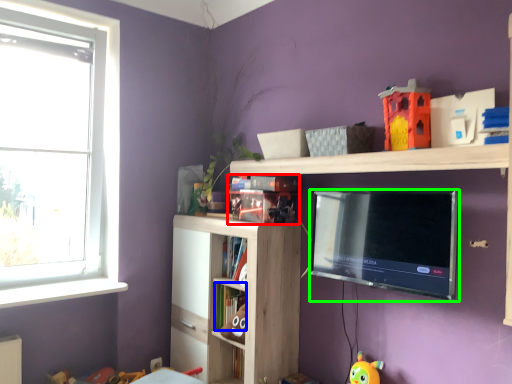
Question: Estimate the real-world distances between objects in this image. Which object is closer to book (highlighted by a red box), book (highlighted by a blue box) or television (highlighted by a green box)?

Choices:
 (A) book
 (B) television

Answer: (B)